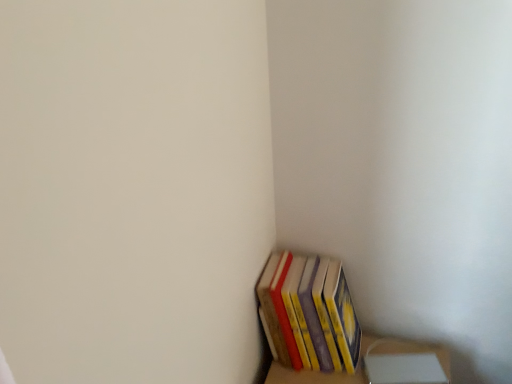
What do you see at coordinates (310, 313) in the screenshot?
I see `hardcover books at lower right` at bounding box center [310, 313].

Where is `hardcover books at lower right`? hardcover books at lower right is located at coordinates (310, 313).

In order to face hardcover books at lower right, should I rotate leftwards or rightwards?

It's best to rotate right around 8.871 degrees.

Measure the distance between point (307,340) and camera.

The depth of point (307,340) is 35.35 inches.

The height and width of the screenshot is (384, 512). What are the coordinates of `hardcover books at lower right` in the screenshot? It's located at point(310,313).